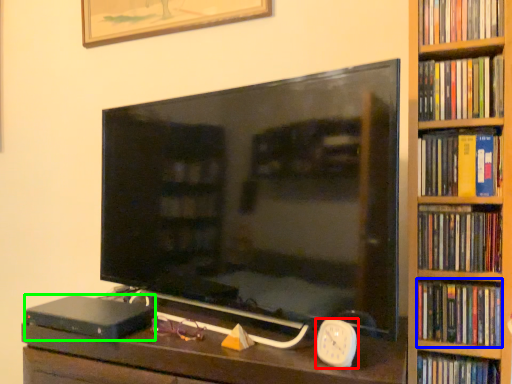
Question: Estimate the real-world distances between objects in this image. Which object is farther from clock (highlighted by a red box), book (highlighted by a blue box) or paperback book (highlighted by a green box)?

Choices:
 (A) book
 (B) paperback book

Answer: (B)